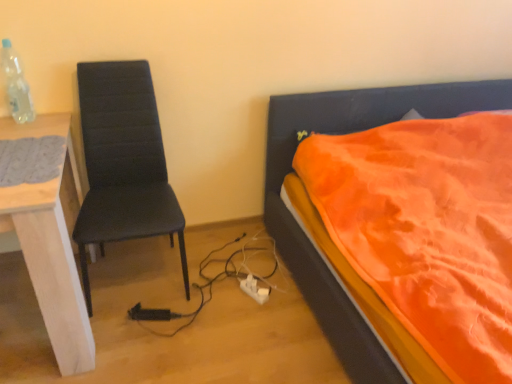
Question: Looking at their shapes, would you say orange fabric bed at right is wider or thinner than white plastic power plugs and sockets at lower center?

Choices:
 (A) thin
 (B) wide

Answer: (B)

Question: Considering the relative positions of orange fabric bed at right and white plastic power plugs and sockets at lower center in the image provided, is orange fabric bed at right to the left or to the right of white plastic power plugs and sockets at lower center?

Choices:
 (A) left
 (B) right

Answer: (B)

Question: Estimate the real-world distances between objects in this image. Which object is farther from the white plastic power plugs and sockets at lower center?

Choices:
 (A) matte black chair at left
 (B) gray knitted mat at left
 (C) clear plastic bottle at upper left
 (D) orange fabric bed at right
 (E) white wood desk at left

Answer: (C)

Question: Based on their relative distances, which object is farther from the clear plastic bottle at upper left?

Choices:
 (A) white plastic power plugs and sockets at lower center
 (B) white wood desk at left
 (C) orange fabric bed at right
 (D) gray knitted mat at left
 (E) matte black chair at left

Answer: (C)